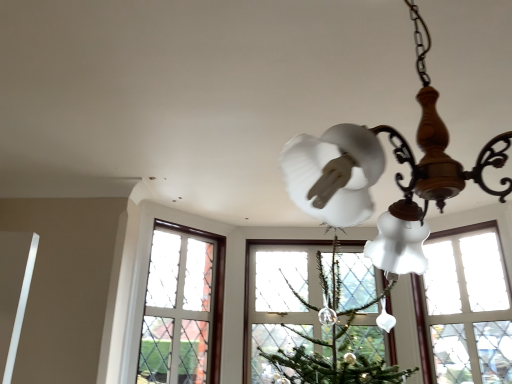
Question: Considering the relative positions of matte white glass chandelier at upper right and clear glass window at center in the image provided, is matte white glass chandelier at upper right to the left or to the right of clear glass window at center?

Choices:
 (A) right
 (B) left

Answer: (B)

Question: Considering the positions of matte white glass chandelier at upper right and clear glass window at center in the image, is matte white glass chandelier at upper right taller or shorter than clear glass window at center?

Choices:
 (A) tall
 (B) short

Answer: (B)

Question: Considering the positions of point (366, 208) and point (433, 349), is point (366, 208) closer or farther from the camera than point (433, 349)?

Choices:
 (A) closer
 (B) farther

Answer: (A)

Question: Choose the correct answer: Is clear glass window at center inside matte white glass chandelier at upper right or outside it?

Choices:
 (A) outside
 (B) inside

Answer: (A)

Question: Looking at the image, does clear glass window at center seem bigger or smaller compared to matte white glass chandelier at upper right?

Choices:
 (A) big
 (B) small

Answer: (B)

Question: From a real-world perspective, is clear glass window at center above or below matte white glass chandelier at upper right?

Choices:
 (A) below
 (B) above

Answer: (A)

Question: Considering the positions of clear glass window at center and matte white glass chandelier at upper right in the image, is clear glass window at center taller or shorter than matte white glass chandelier at upper right?

Choices:
 (A) tall
 (B) short

Answer: (A)